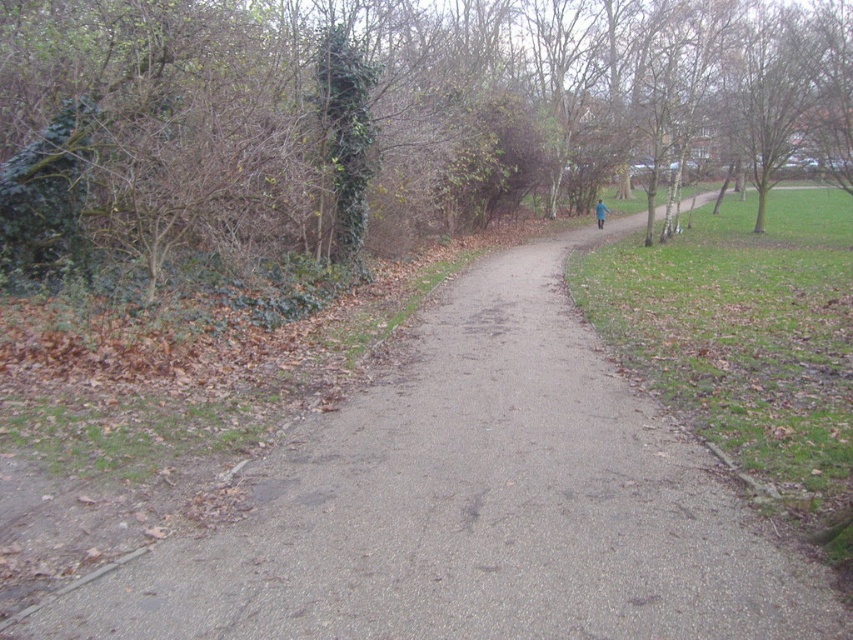
Who is positioned more to the left, green ivy-covered tree at left or gray asphalt trail at center?

Positioned to the left is gray asphalt trail at center.

Between point (740, 76) and point (157, 564), which one is positioned behind?

Positioned behind is point (740, 76).

At what (x,y) coordinates should I click in order to perform the action: click on green ivy-covered tree at left. Please return your answer as a coordinate pair (x, y). Looking at the image, I should click on (386, 112).

Is green ivy-covered tree at left above blue fabric jacket at upper center?

Correct, green ivy-covered tree at left is located above blue fabric jacket at upper center.

Can you confirm if green ivy-covered tree at left is taller than blue fabric jacket at upper center?

Yes, green ivy-covered tree at left is taller than blue fabric jacket at upper center.

Which is in front, point (593, 170) or point (602, 218)?

Point (602, 218) is in front.

Find the location of `green ivy-covered tree at left`. green ivy-covered tree at left is located at coordinates (386, 112).

Who is higher up, gray asphalt trail at center or blue fabric jacket at upper center?

blue fabric jacket at upper center is above.

Who is positioned more to the left, gray asphalt trail at center or blue fabric jacket at upper center?

gray asphalt trail at center

Between point (523, 356) and point (599, 212), which one is positioned in front?

Point (523, 356) is more forward.

In order to click on gray asphalt trail at center in this screenshot , I will do `click(474, 504)`.